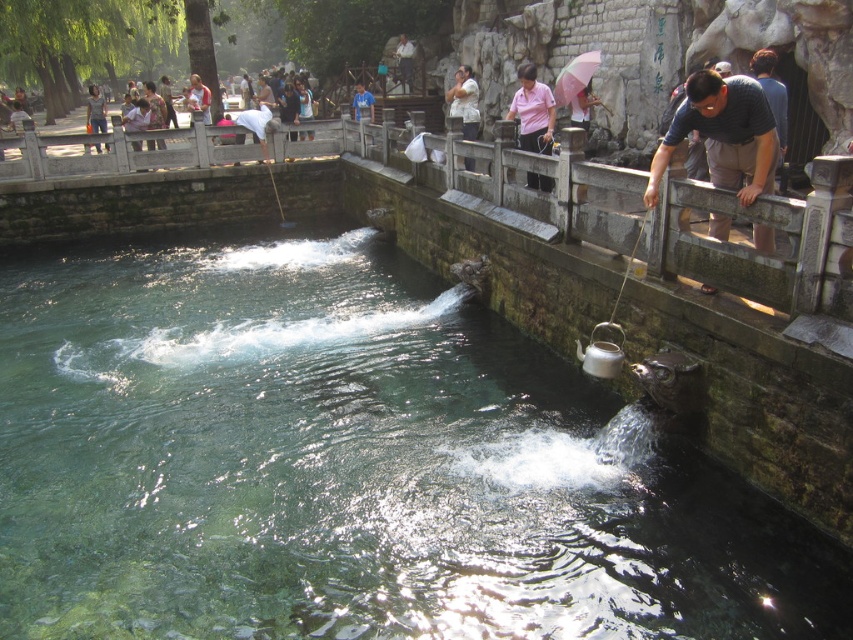
Does clear glass water at center appear on the right side of light brown fabric shirt at upper center?

Correct, you'll find clear glass water at center to the right of light brown fabric shirt at upper center.

How distant is clear glass water at center from light brown fabric shirt at upper center?

41.50 feet

This screenshot has width=853, height=640. What are the coordinates of `clear glass water at center` in the screenshot? It's located at (351, 464).

Where is `clear glass water at center`? The width and height of the screenshot is (853, 640). clear glass water at center is located at coordinates (351, 464).

Between light brown leather jacket at upper left and light brown fabric shirt at upper center, which one appears on the right side from the viewer's perspective?

light brown fabric shirt at upper center

Who is taller, light brown leather jacket at upper left or light brown fabric shirt at upper center?

light brown leather jacket at upper left

Between point (100, 109) and point (206, 92), which one is positioned behind?

Positioned behind is point (206, 92).

Locate an element on the screen. The image size is (853, 640). light brown leather jacket at upper left is located at coordinates (96, 112).

Consider the image. Is pink fabric at upper center wider than blue shirt at center?

In fact, pink fabric at upper center might be narrower than blue shirt at center.

Is point (469, 160) positioned after point (355, 84)?

No, (469, 160) is in front of (355, 84).

Describe the element at coordinates (463, 100) in the screenshot. I see `pink fabric at upper center` at that location.

The image size is (853, 640). In order to click on pink fabric at upper center in this screenshot , I will do coord(463,100).